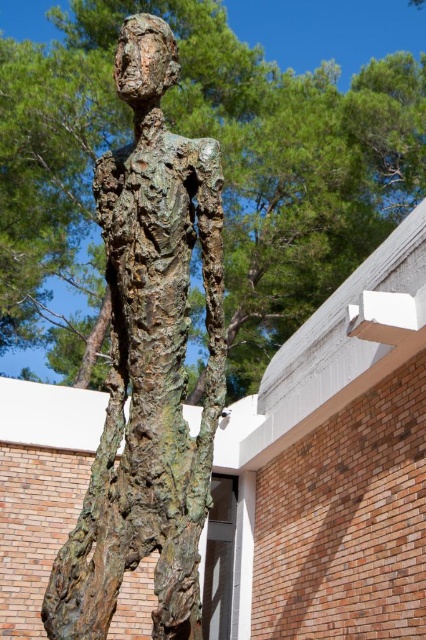
You are an architect planning to install a new bench in the courtyard. The bench needs to be placed between the rusty bronze figure at center and the green textured tree at center. If the bench requires 2 meters of space between the two objects, will there be enough space?

The rusty bronze figure at center is shorter than the green textured tree at center, but the height difference does not indicate the distance between them. Without information about their spatial separation, it is impossible to determine if there is enough space for the bench.

You are an artist planning to photograph the rusty bronze figure at center and the green textured tree at center. Which object should you focus on first if you want to capture the narrower subject?

The rusty bronze figure at center is thinner than the green textured tree at center, so you should focus on the rusty bronze figure at center first to capture the narrower subject.